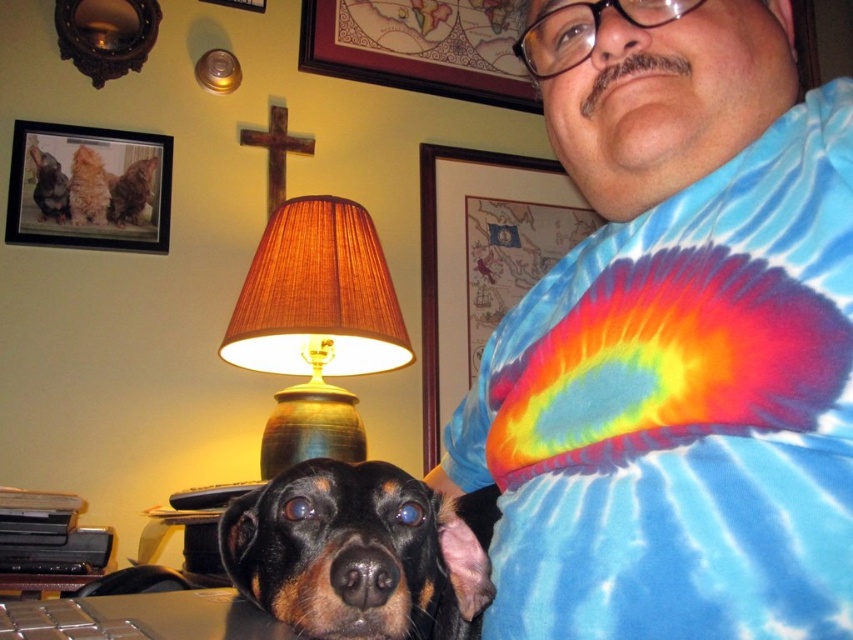
Between point (654, 36) and point (456, 40), which one is positioned behind?

Point (456, 40)

Identify the location of tie-dye fabric shirt at center. This screenshot has width=853, height=640. (677, 349).

I want to click on tie-dye fabric shirt at center, so click(677, 349).

Can you confirm if brown fabric lampshade at upper center is smaller than tie-dye fabric at upper right?

Yes.

Is brown fabric lampshade at upper center above tie-dye fabric at upper right?

Incorrect, brown fabric lampshade at upper center is not positioned above tie-dye fabric at upper right.

Does point (357, 433) come closer to viewer compared to point (578, 227)?

Yes, it is.

Where is `brown fabric lampshade at upper center`? The image size is (853, 640). brown fabric lampshade at upper center is located at coordinates (316, 324).

Is wooden frame at upper left above black plastic keyboard at lower left?

Yes, wooden frame at upper left is above black plastic keyboard at lower left.

I want to click on wooden frame at upper left, so coord(88,188).

Is point (128, 141) farther from viewer compared to point (35, 625)?

Yes, point (128, 141) is behind point (35, 625).

In order to click on wooden frame at upper left in this screenshot , I will do `click(88, 188)`.